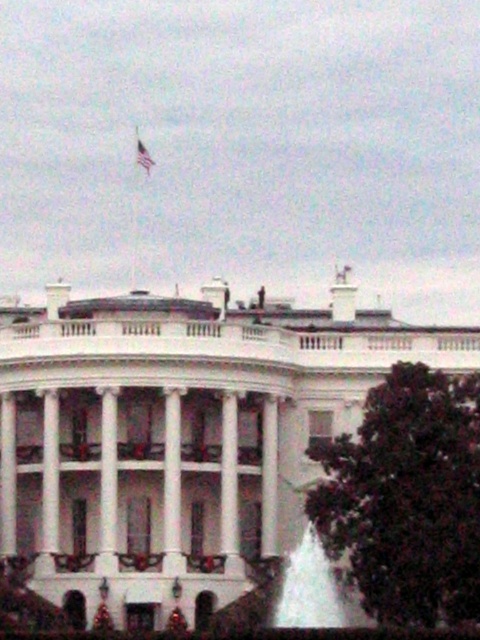
Question: Is white glossy fountain at lower center positioned in front of silky fabric flag at upper center?

Choices:
 (A) yes
 (B) no

Answer: (A)

Question: Does white glossy fountain at lower center appear under silky fabric flag at upper center?

Choices:
 (A) no
 (B) yes

Answer: (B)

Question: Which point is farther to the camera?

Choices:
 (A) silky fabric flag at upper center
 (B) white glossy fountain at lower center

Answer: (A)

Question: Can you confirm if white glossy fountain at lower center is positioned to the left of silky fabric flag at upper center?

Choices:
 (A) yes
 (B) no

Answer: (B)